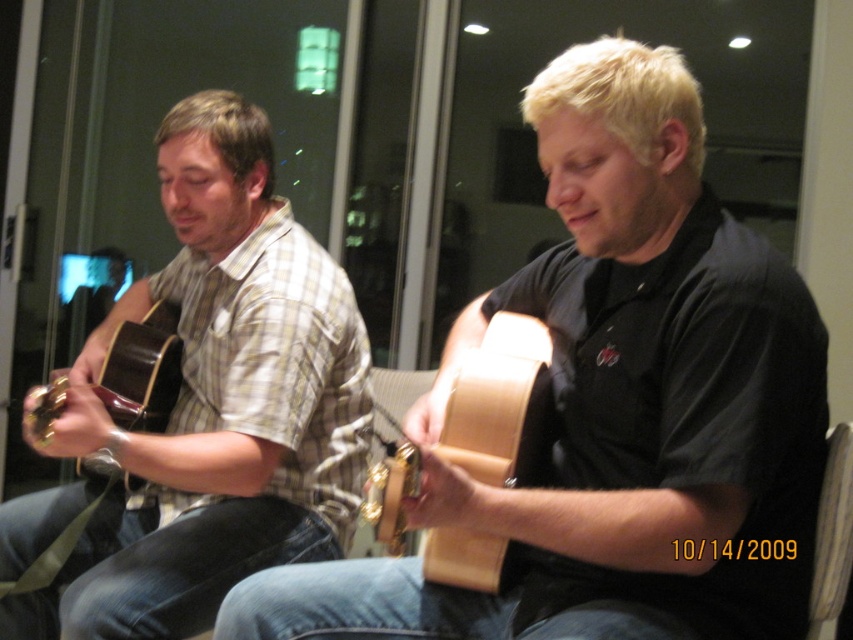
Question: Is natural wood acoustic guitar at center behind brown leather armchair at lower right?

Choices:
 (A) no
 (B) yes

Answer: (A)

Question: Is matte wood guitar at center in front of brown leather armchair at lower right?

Choices:
 (A) yes
 (B) no

Answer: (A)

Question: Does natural wood acoustic guitar at center come in front of brown leather armchair at lower right?

Choices:
 (A) no
 (B) yes

Answer: (B)

Question: Among these points, which one is farthest from the camera?

Choices:
 (A) (239, 541)
 (B) (141, 428)

Answer: (B)

Question: Which object appears farthest from the camera in this image?

Choices:
 (A) matte brown acoustic guitar at left
 (B) natural wood acoustic guitar at center

Answer: (A)

Question: Which point is farther to the camera?

Choices:
 (A) (123, 426)
 (B) (329, 497)
 (C) (508, 564)
 (D) (811, 609)

Answer: (A)